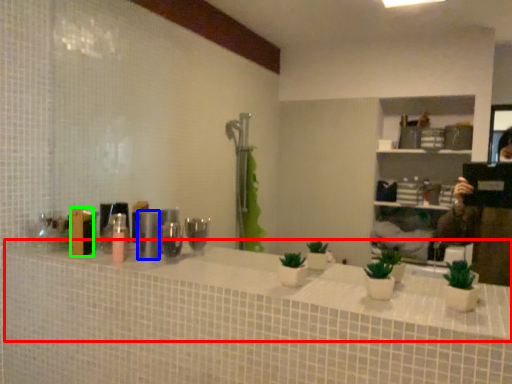
Question: Based on their relative distances, which object is nearer to counter top (highlighted by a red box)? Choose from toiletry (highlighted by a blue box) and toiletry (highlighted by a green box).

Choices:
 (A) toiletry
 (B) toiletry

Answer: (A)